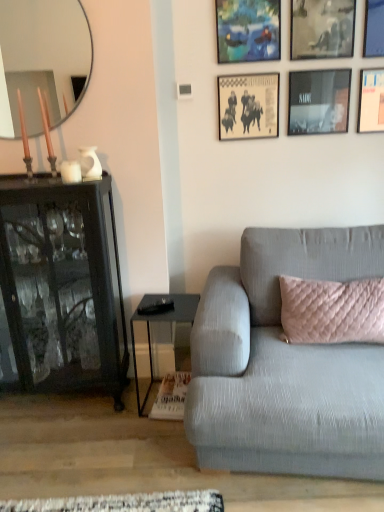
Question: Considering their positions, is metallic silver picture frame at upper right, positioned as the sixth picture frame in left-to-right order, located in front of or behind textured gray couch at right?

Choices:
 (A) behind
 (B) front

Answer: (A)

Question: Is metallic silver picture frame at upper right, the 1th picture frame in the right-to-left sequence, taller or shorter than textured gray couch at right?

Choices:
 (A) tall
 (B) short

Answer: (B)

Question: Estimate the real-world distances between objects in this image. Which object is farther from the black glossy picture frame at upper right, which is the third picture frame in left-to-right order?

Choices:
 (A) beige paper picture frame at upper center, which ranks as the 5th picture frame in right-to-left order
 (B) black glass cabinet at left
 (C) metallic silver picture frame at upper right, the 1th picture frame in the right-to-left sequence
 (D) matte glass mirror at upper left
 (E) textured gray couch at right

Answer: (B)

Question: Which object is positioned closest to the black plastic remote control at lower center?

Choices:
 (A) black glossy picture frame at upper right, the 4th picture frame from the left
 (B) blue textured fabric picture frame at upper center, positioned as the 6th picture frame in right-to-left order
 (C) metallic silver picture frame at upper right, the 1th picture frame in the right-to-left sequence
 (D) metallic glass table at lower center
 (E) beige paper picture frame at upper center, the second picture frame from the left

Answer: (D)